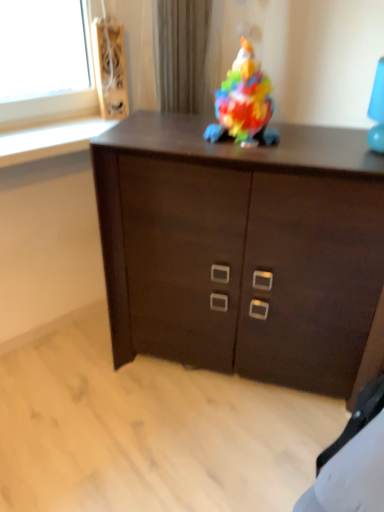
Find the location of `vacant space to the left of dark wood cabinet at center`. vacant space to the left of dark wood cabinet at center is located at coordinates (84, 418).